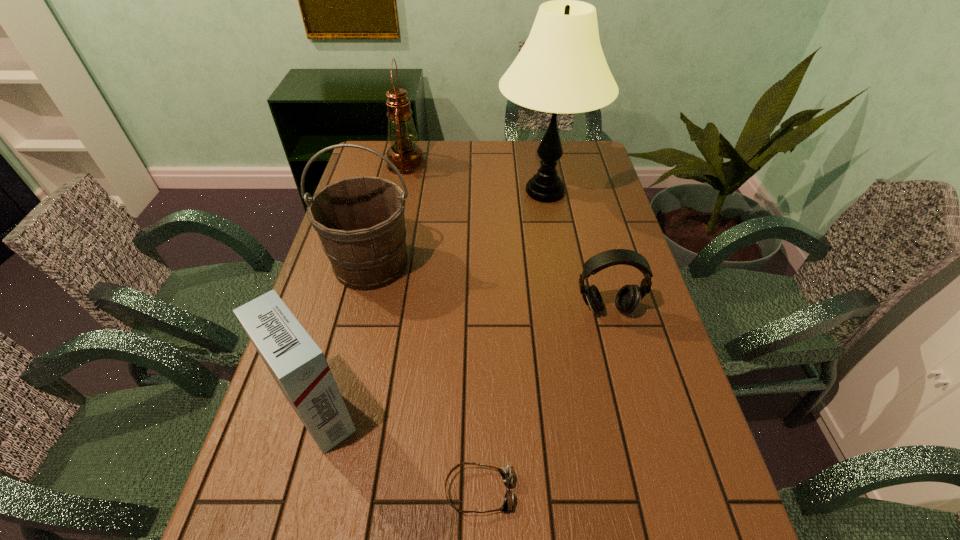
You are a GUI agent. You are given a task and a screenshot of the screen. Output one action in this format:
    pyautogui.click(x=<x>, y=<y>)
    Task: Click on the free space located 0.070m on the front of the oil lamp
    This screenshot has width=960, height=540.
    Given the screenshot: What is the action you would take?
    pyautogui.click(x=401, y=189)

I want to click on blank space located on the right of the fourth nearest object, so click(465, 265).

Locate an element on the screen. This screenshot has width=960, height=540. free space located 0.260m on the back of the second nearest object is located at coordinates (351, 291).

Where is `vacant space situated on the ear cups of the fifth tallest object`? vacant space situated on the ear cups of the fifth tallest object is located at coordinates (640, 442).

You are a GUI agent. You are given a task and a screenshot of the screen. Output one action in this format:
    pyautogui.click(x=<x>, y=<y>)
    Task: Click on the vacant space located 0.130m on the front-facing side of the shortest object
    
    Given the screenshot: What is the action you would take?
    pyautogui.click(x=580, y=491)

You are a GUI agent. You are given a task and a screenshot of the screen. Output one action in this format:
    pyautogui.click(x=<x>, y=<y>)
    Task: Click on the lamp that is at the far edge
    The height and width of the screenshot is (540, 960).
    Given the screenshot: What is the action you would take?
    pyautogui.click(x=561, y=68)

This screenshot has height=540, width=960. Identify the location of oil lamp that is at the far edge. (404, 153).

Locate an element on the screen. The width and height of the screenshot is (960, 540). oil lamp present at the left edge is located at coordinates (404, 153).

The width and height of the screenshot is (960, 540). In order to click on bucket present at the left edge in this screenshot , I will do `click(360, 221)`.

Image resolution: width=960 pixels, height=540 pixels. I want to click on cigarette case located in the left edge section of the desktop, so click(x=299, y=367).